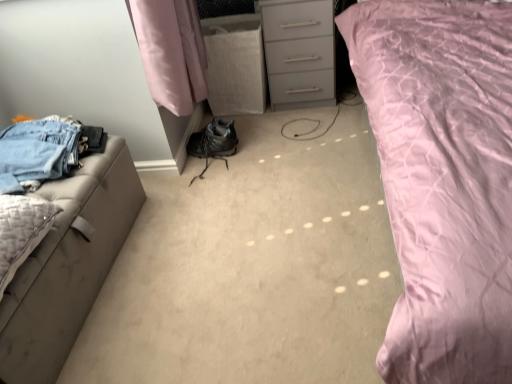
What is the approximate width of textured beige pillow at left?

textured beige pillow at left is 9.89 inches in width.

Locate an element on the screen. matte gray chest of drawers at center is located at coordinates (300, 53).

Describe the element at coordinates (37, 152) in the screenshot. The height and width of the screenshot is (384, 512). I see `denim jeans at left` at that location.

This screenshot has height=384, width=512. In order to click on textured beige pillow at left in this screenshot , I will do tap(21, 231).

From a real-world perspective, is pink quilted fabric at upper right positioned under leatherette ottoman at left based on gravity?

No, from a real-world perspective, pink quilted fabric at upper right is not under leatherette ottoman at left.

Is point (511, 195) positioned before point (79, 204)?

Yes, point (511, 195) is closer to viewer.

Where is `furniture behind the pink quilted fabric at upper right`? Image resolution: width=512 pixels, height=384 pixels. furniture behind the pink quilted fabric at upper right is located at coordinates (68, 265).

Is pink quilted fabric at upper right positioned before leatherette ottoman at left?

Yes.

Does denim jeans at left have a greater width compared to textured beige pillow at left?

Yes.

Looking at this image, from a real-world perspective, is denim jeans at left physically below textured beige pillow at left?

No, from a real-world perspective, denim jeans at left is not under textured beige pillow at left.

Is denim jeans at left inside or outside of textured beige pillow at left?

denim jeans at left is located beyond the bounds of textured beige pillow at left.

How different are the orientations of textured beige pillow at left and leatherette ottoman at left in degrees?

The angular difference between textured beige pillow at left and leatherette ottoman at left is 0.000487 degrees.

Is textured beige pillow at left facing away from leatherette ottoman at left?

No.

From the picture: Would you say leatherette ottoman at left is part of textured beige pillow at left's contents?

Actually, leatherette ottoman at left is outside textured beige pillow at left.

Considering the positions of objects textured beige pillow at left and leatherette ottoman at left in the image provided, who is more to the right, textured beige pillow at left or leatherette ottoman at left?

Positioned to the right is textured beige pillow at left.

In the scene shown: Is denim jeans at left closer to camera compared to matte gray chest of drawers at center?

Yes, denim jeans at left is closer to the camera.

Does denim jeans at left have a lesser width compared to matte gray chest of drawers at center?

No.

Is matte gray chest of drawers at center at the back of denim jeans at left?

No, matte gray chest of drawers at center is not at the back of denim jeans at left.

How much distance is there between pink quilted fabric at upper right and textured beige pillow at left?

pink quilted fabric at upper right is 3.79 feet from textured beige pillow at left.

Can we say pink quilted fabric at upper right lies outside textured beige pillow at left?

That's correct, pink quilted fabric at upper right is outside of textured beige pillow at left.

Considering the sizes of pink quilted fabric at upper right and textured beige pillow at left in the image, is pink quilted fabric at upper right wider or thinner than textured beige pillow at left?

In the image, pink quilted fabric at upper right appears to be wider than textured beige pillow at left.

Is pink quilted fabric at upper right facing towards textured beige pillow at left?

No.

Is point (18, 250) positioned in front of point (271, 75)?

That is True.

Could you tell me if textured beige pillow at left is turned towards matte gray chest of drawers at center?

No, textured beige pillow at left does not turn towards matte gray chest of drawers at center.

Does textured beige pillow at left have a lesser width compared to matte gray chest of drawers at center?

Yes.

Would you say textured beige pillow at left contains matte gray chest of drawers at center?

Definitely not — matte gray chest of drawers at center is not inside textured beige pillow at left.

Could you tell me if matte gray chest of drawers at center is facing pink quilted fabric at upper right?

No, matte gray chest of drawers at center is not oriented towards pink quilted fabric at upper right.

How far apart are matte gray chest of drawers at center and pink quilted fabric at upper right?

They are 29.54 inches apart.

Between matte gray chest of drawers at center and pink quilted fabric at upper right, which one has smaller width?

With smaller width is matte gray chest of drawers at center.

Considering the relative positions of matte gray chest of drawers at center and pink quilted fabric at upper right in the image provided, is matte gray chest of drawers at center to the left of pink quilted fabric at upper right from the viewer's perspective?

Yes, matte gray chest of drawers at center is to the left of pink quilted fabric at upper right.

This screenshot has height=384, width=512. Find the location of `bed to the right of leatherette ottoman at left`. bed to the right of leatherette ottoman at left is located at coordinates (442, 180).

Where is `pillow located below the denim jeans at left (from the image's perspective)`? The height and width of the screenshot is (384, 512). pillow located below the denim jeans at left (from the image's perspective) is located at coordinates (21, 231).

Looking at the image, which one is located closer to denim jeans at left, matte gray chest of drawers at center or textured beige pillow at left?

textured beige pillow at left.

In the scene shown: When comparing their distances from pink quilted fabric at upper right, does textured beige pillow at left or leatherette ottoman at left seem further?

The object further to pink quilted fabric at upper right is textured beige pillow at left.

Based on their spatial positions, is denim jeans at left or textured beige pillow at left further from matte gray chest of drawers at center?

textured beige pillow at left is positioned further to the anchor matte gray chest of drawers at center.

Based on their spatial positions, is leatherette ottoman at left or textured beige pillow at left further from denim jeans at left?

textured beige pillow at left is positioned further to the anchor denim jeans at left.

Based on their spatial positions, is textured beige pillow at left or pink quilted fabric at upper right further from denim jeans at left?

pink quilted fabric at upper right is further to denim jeans at left.

Looking at the image, which one is located closer to pink quilted fabric at upper right, leatherette ottoman at left or matte gray chest of drawers at center?

matte gray chest of drawers at center lies closer to pink quilted fabric at upper right than the other object.

Considering their positions, is denim jeans at left positioned further to pink quilted fabric at upper right than textured beige pillow at left?

denim jeans at left lies further to pink quilted fabric at upper right than the other object.

Considering their positions, is textured beige pillow at left positioned further to pink quilted fabric at upper right than matte gray chest of drawers at center?

textured beige pillow at left is positioned further to the anchor pink quilted fabric at upper right.

Find the location of a particular element. The image size is (512, 384). pillow between denim jeans at left and pink quilted fabric at upper right from left to right is located at coordinates (21, 231).

You are a GUI agent. You are given a task and a screenshot of the screen. Output one action in this format:
    pyautogui.click(x=<x>, y=<y>)
    Task: Click on the pillow between leatherette ottoman at left and pink quilted fabric at upper right
    This screenshot has height=384, width=512.
    Given the screenshot: What is the action you would take?
    pyautogui.click(x=21, y=231)

You are a GUI agent. You are given a task and a screenshot of the screen. Output one action in this format:
    pyautogui.click(x=<x>, y=<y>)
    Task: Click on the pillow located between denim jeans at left and matte gray chest of drawers at center in the left-right direction
    The height and width of the screenshot is (384, 512).
    Given the screenshot: What is the action you would take?
    pyautogui.click(x=21, y=231)

You are a GUI agent. You are given a task and a screenshot of the screen. Output one action in this format:
    pyautogui.click(x=<x>, y=<y>)
    Task: Click on the furniture situated between denim jeans at left and matte gray chest of drawers at center from left to right
    Image resolution: width=512 pixels, height=384 pixels.
    Given the screenshot: What is the action you would take?
    pyautogui.click(x=68, y=265)